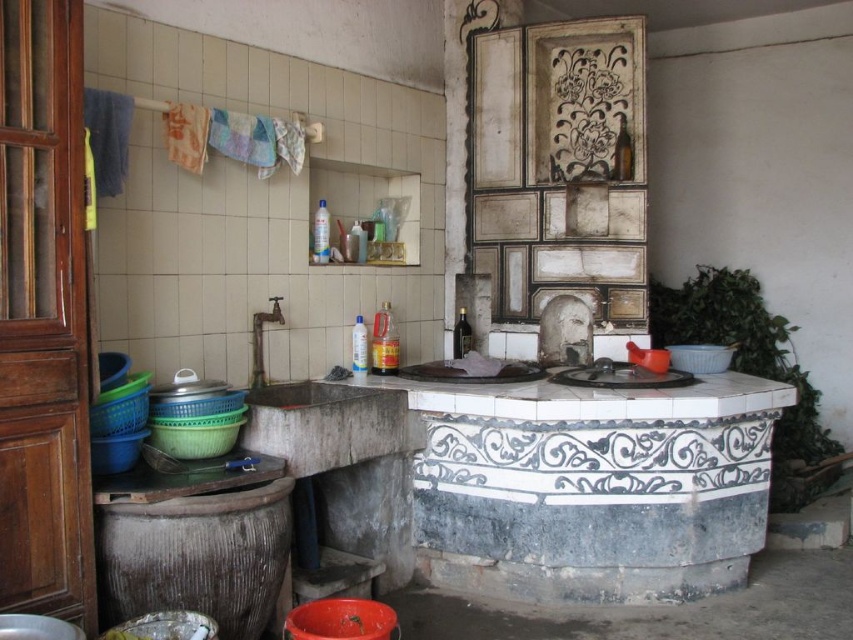
Question: Which object appears closest to the camera in this image?

Choices:
 (A) black stone sink at center
 (B) rusty metal sink at center
 (C) gray stone sink at center

Answer: (B)

Question: Is orange plastic stool at lower center to the right of gray stone sink at center from the viewer's perspective?

Choices:
 (A) no
 (B) yes

Answer: (B)

Question: Observing the image, what is the correct spatial positioning of rusty metal sink at center in reference to orange plastic stool at lower center?

Choices:
 (A) below
 (B) above

Answer: (B)

Question: Observing the image, what is the correct spatial positioning of gray stone sink at center in reference to black stone sink at center?

Choices:
 (A) left
 (B) right

Answer: (A)

Question: Which object is closer to the camera taking this photo?

Choices:
 (A) white glossy sink at center
 (B) orange plastic stool at lower center
 (C) gray stone sink at center
 (D) rusty metal sink at center

Answer: (D)

Question: Among these objects, which one is nearest to the camera?

Choices:
 (A) black stone sink at center
 (B) white glossy sink at center

Answer: (B)